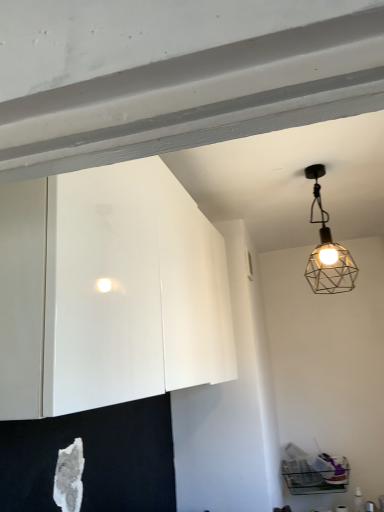
Question: Is white glossy cabinet at upper left thinner than metallic wireframe lamp at upper right?

Choices:
 (A) no
 (B) yes

Answer: (A)

Question: Are white glossy cabinet at upper left and metallic wireframe lamp at upper right located far from each other?

Choices:
 (A) no
 (B) yes

Answer: (B)

Question: Is white glossy cabinet at upper left next to metallic wireframe lamp at upper right?

Choices:
 (A) yes
 (B) no

Answer: (B)

Question: Can you confirm if white glossy cabinet at upper left is taller than metallic wireframe lamp at upper right?

Choices:
 (A) yes
 (B) no

Answer: (A)

Question: Is white glossy cabinet at upper left positioned before metallic wireframe lamp at upper right?

Choices:
 (A) no
 (B) yes

Answer: (B)

Question: Can you confirm if white glossy cabinet at upper left is wider than metallic wireframe lamp at upper right?

Choices:
 (A) no
 (B) yes

Answer: (B)

Question: From the image's perspective, is metallic wireframe lamp at upper right below white glossy cabinet at upper left?

Choices:
 (A) yes
 (B) no

Answer: (B)

Question: Considering the relative sizes of metallic wireframe lamp at upper right and white glossy cabinet at upper left in the image provided, is metallic wireframe lamp at upper right bigger than white glossy cabinet at upper left?

Choices:
 (A) no
 (B) yes

Answer: (A)

Question: Is metallic wireframe lamp at upper right facing towards white glossy cabinet at upper left?

Choices:
 (A) no
 (B) yes

Answer: (A)

Question: From the image's perspective, would you say metallic wireframe lamp at upper right is positioned over white glossy cabinet at upper left?

Choices:
 (A) no
 (B) yes

Answer: (B)

Question: Is metallic wireframe lamp at upper right not near white glossy cabinet at upper left?

Choices:
 (A) yes
 (B) no

Answer: (A)

Question: From a real-world perspective, is metallic wireframe lamp at upper right on white glossy cabinet at upper left?

Choices:
 (A) no
 (B) yes

Answer: (B)

Question: Considering the positions of metallic wireframe lamp at upper right and white glossy cabinet at upper left in the image, is metallic wireframe lamp at upper right bigger or smaller than white glossy cabinet at upper left?

Choices:
 (A) big
 (B) small

Answer: (B)